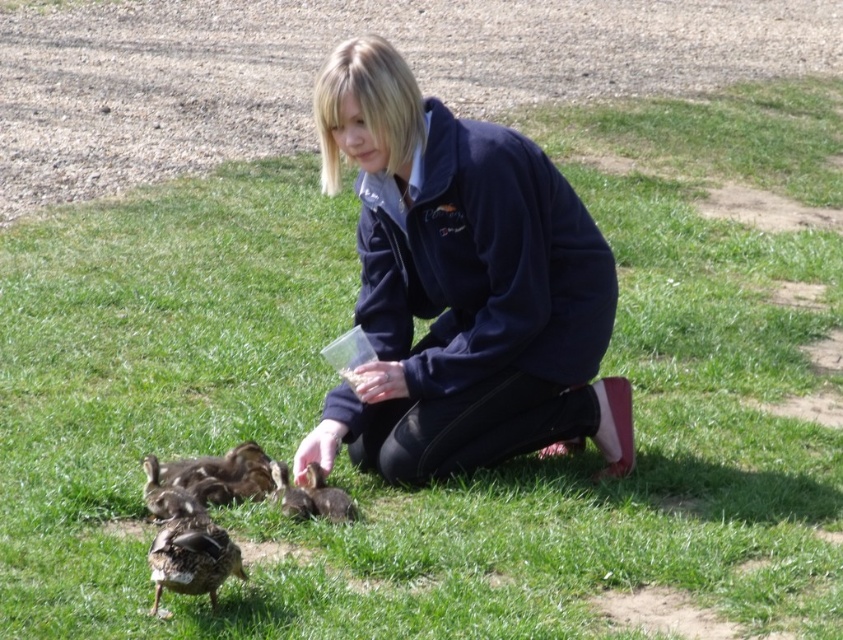
Question: Which point is farther to the camera?

Choices:
 (A) brown fuzzy ducklings at center
 (B) brown fuzzy duckling at lower left
 (C) brown fuzzy duck at lower center
 (D) brown fuzzy duckling at lower center

Answer: (C)

Question: In this image, where is brown feathered duckling at lower left located relative to brown fuzzy ducklings at center?

Choices:
 (A) left
 (B) right

Answer: (B)

Question: Does navy blue fleece at center appear under brown fuzzy duck at lower center?

Choices:
 (A) yes
 (B) no

Answer: (B)

Question: Does brown feathered duckling at lower left appear on the right side of brown fuzzy duckling at lower center?

Choices:
 (A) no
 (B) yes

Answer: (A)

Question: Which object is closer to the camera taking this photo?

Choices:
 (A) brown fuzzy duckling at lower center
 (B) brown fuzzy ducklings at center
 (C) navy blue fleece at center

Answer: (C)

Question: Estimate the real-world distances between objects in this image. Which object is farther from the brown fuzzy duckling at lower left?

Choices:
 (A) brown fuzzy duckling at lower center
 (B) brown fuzzy duck at lower center
 (C) brown feathered duckling at lower left

Answer: (A)